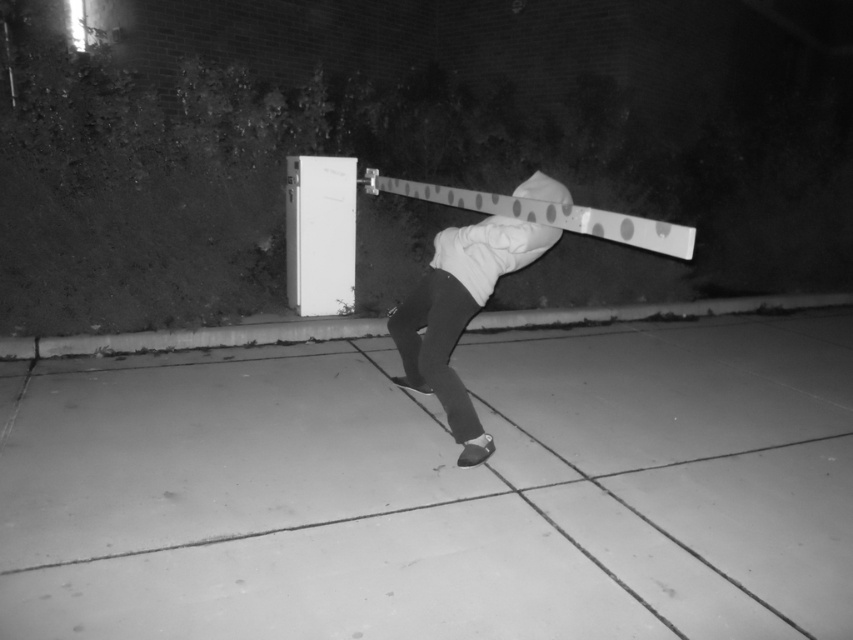
Is smooth concrete pavement at center to the left of white matte hoodie at center from the viewer's perspective?

In fact, smooth concrete pavement at center is to the right of white matte hoodie at center.

Is point (160, 477) farther from camera compared to point (422, 324)?

No, it is not.

Between point (213, 508) and point (444, 305), which one is positioned in front?

Point (213, 508)

You are a GUI agent. You are given a task and a screenshot of the screen. Output one action in this format:
    pyautogui.click(x=<x>, y=<y>)
    Task: Click on the smooth concrete pavement at center
    This screenshot has height=640, width=853.
    Given the screenshot: What is the action you would take?
    pyautogui.click(x=440, y=490)